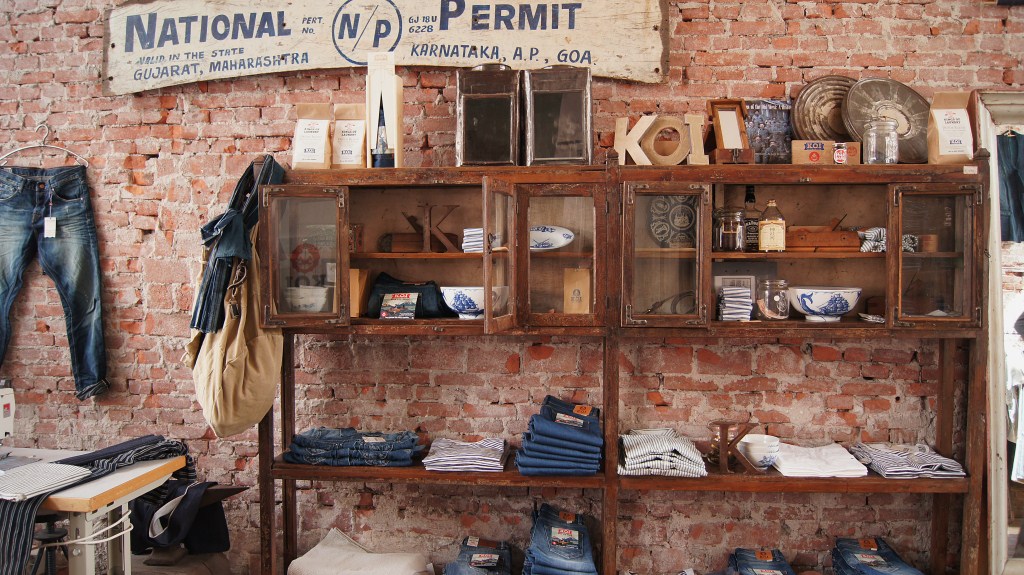
At what (x,y) coordinates should I click in order to perform the action: click on cabinet. Please return your answer as a coordinate pair (x, y). Looking at the image, I should click on (776, 273), (439, 264).